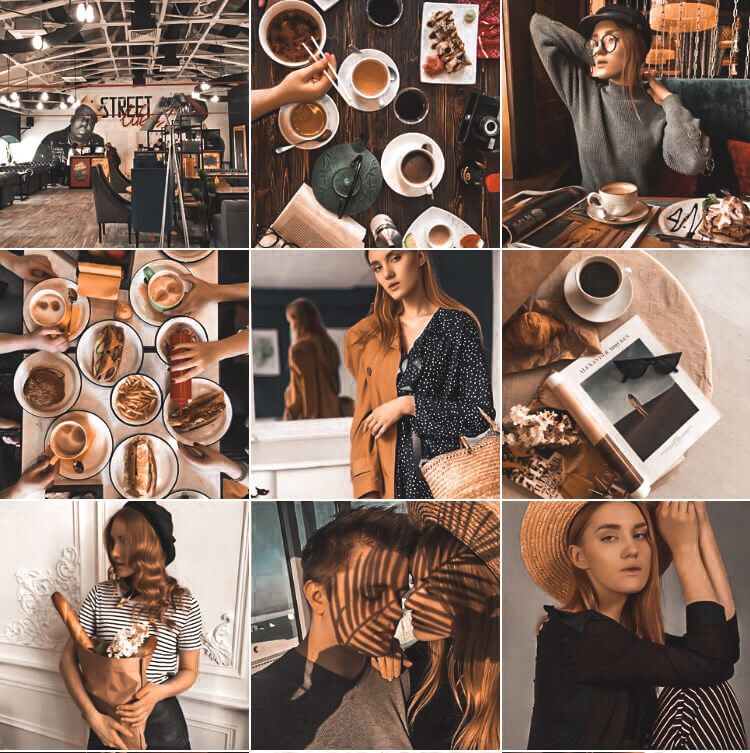
Where is `cups of coffee`? The width and height of the screenshot is (750, 753). cups of coffee is located at coordinates (163, 291), (45, 308), (70, 441), (609, 285), (622, 194).